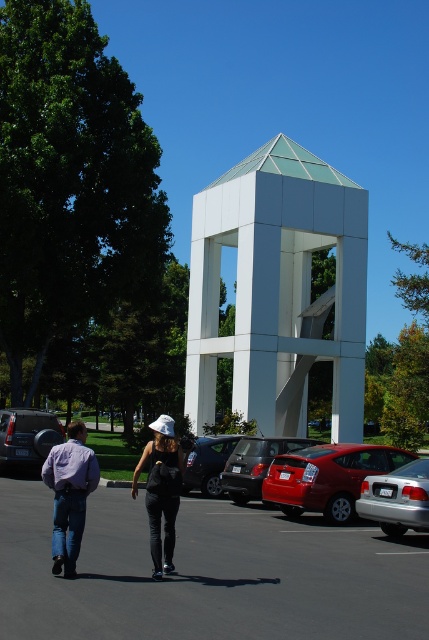
You are standing in the parking lot and see two points marked in the scene. Which point, point (344, 499) or point (266, 438), is closer to you?

Point (344, 499) is closer to the viewer than point (266, 438).

You are a photographer trying to capture both the white matte tower at center and the glossy red car at center in a single frame. Considering their sizes, which object should you focus on to ensure both are clearly visible in the photo?

The white matte tower at center is bigger than the glossy red car at center, so to ensure both are clearly visible, focus on the white matte tower at center as the primary subject while positioning the glossy red car at center in the background or side to balance the composition.

You are a photographer trying to capture both the shiny red car at lower right and the matte black car at center in a single shot. Considering their sizes, which car should you focus on to ensure both fit in the frame without cropping?

The shiny red car at lower right is larger in size than the matte black car at center, so you should focus on positioning the camera to accommodate the larger car first, ensuring both fit within the frame.